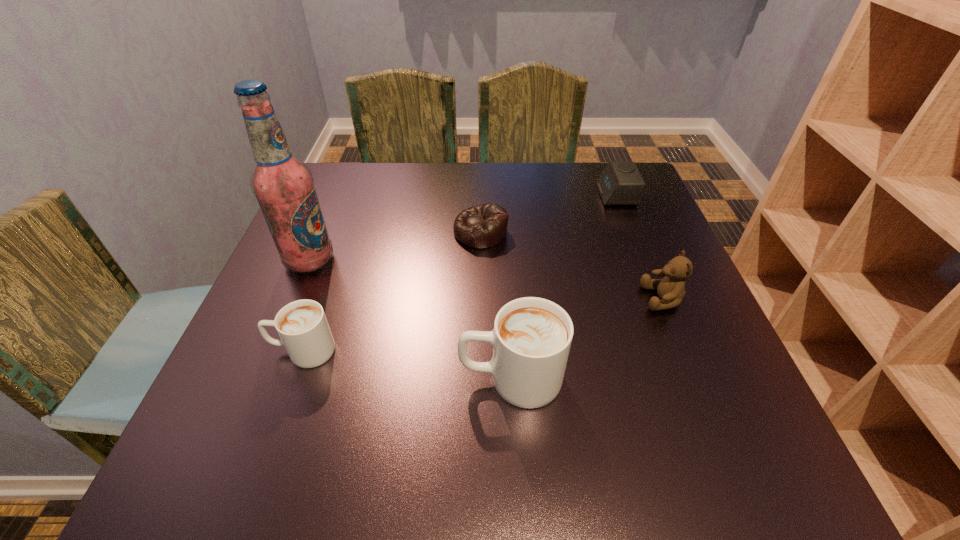
Locate an element on the screen. The image size is (960, 540). vacant place for an extra cappuccino on the right is located at coordinates (743, 409).